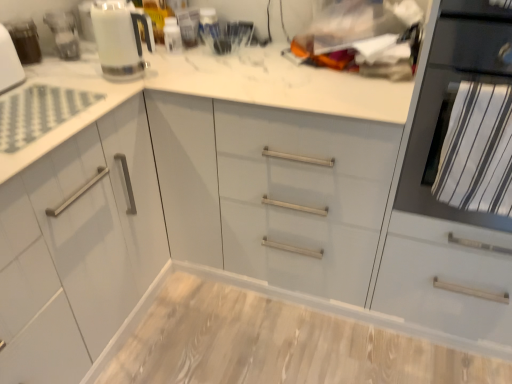
Question: From a real-world perspective, does wooden at center stand above matte white kettle at upper left?

Choices:
 (A) yes
 (B) no

Answer: (B)

Question: Does wooden at center have a lesser width compared to matte white kettle at upper left?

Choices:
 (A) no
 (B) yes

Answer: (A)

Question: Is wooden at center closer to camera compared to matte white kettle at upper left?

Choices:
 (A) no
 (B) yes

Answer: (B)

Question: Is wooden at center positioned beyond the bounds of matte white kettle at upper left?

Choices:
 (A) yes
 (B) no

Answer: (A)

Question: Considering the relative positions of wooden at center and matte white kettle at upper left in the image provided, is wooden at center to the left of matte white kettle at upper left from the viewer's perspective?

Choices:
 (A) yes
 (B) no

Answer: (B)

Question: Considering the relative sizes of wooden at center and matte white kettle at upper left in the image provided, is wooden at center taller than matte white kettle at upper left?

Choices:
 (A) no
 (B) yes

Answer: (A)

Question: Could matte white kettle at upper left be considered to be inside black matte oven at right?

Choices:
 (A) no
 (B) yes

Answer: (A)

Question: Can you confirm if black matte oven at right is bigger than matte white kettle at upper left?

Choices:
 (A) no
 (B) yes

Answer: (B)

Question: Can you confirm if black matte oven at right is thinner than matte white kettle at upper left?

Choices:
 (A) no
 (B) yes

Answer: (A)

Question: Is black matte oven at right smaller than matte white kettle at upper left?

Choices:
 (A) no
 (B) yes

Answer: (A)

Question: Is black matte oven at right located outside matte white kettle at upper left?

Choices:
 (A) yes
 (B) no

Answer: (A)

Question: Is black matte oven at right placed right next to matte white kettle at upper left?

Choices:
 (A) no
 (B) yes

Answer: (A)

Question: Is matte white kettle at upper left further to the viewer compared to black matte oven at right?

Choices:
 (A) no
 (B) yes

Answer: (B)